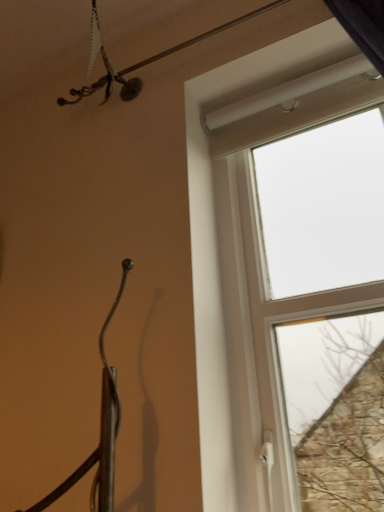
Question: From a real-world perspective, is metallic wire at upper center physically located above or below white plastic window at upper right?

Choices:
 (A) above
 (B) below

Answer: (A)

Question: In terms of height, does metallic wire at upper center look taller or shorter compared to white plastic window at upper right?

Choices:
 (A) tall
 (B) short

Answer: (B)

Question: Is metallic wire at upper center wider or thinner than white plastic window at upper right?

Choices:
 (A) thin
 (B) wide

Answer: (B)

Question: Considering the relative positions of white plastic window at upper right and metallic wire at upper center in the image provided, is white plastic window at upper right to the left or to the right of metallic wire at upper center?

Choices:
 (A) left
 (B) right

Answer: (B)

Question: Is white plastic window at upper right taller or shorter than metallic wire at upper center?

Choices:
 (A) tall
 (B) short

Answer: (A)

Question: Is point (243, 81) positioned closer to the camera than point (218, 29)?

Choices:
 (A) farther
 (B) closer

Answer: (A)

Question: Considering the positions of white plastic window at upper right and metallic wire at upper center in the image, is white plastic window at upper right wider or thinner than metallic wire at upper center?

Choices:
 (A) thin
 (B) wide

Answer: (A)